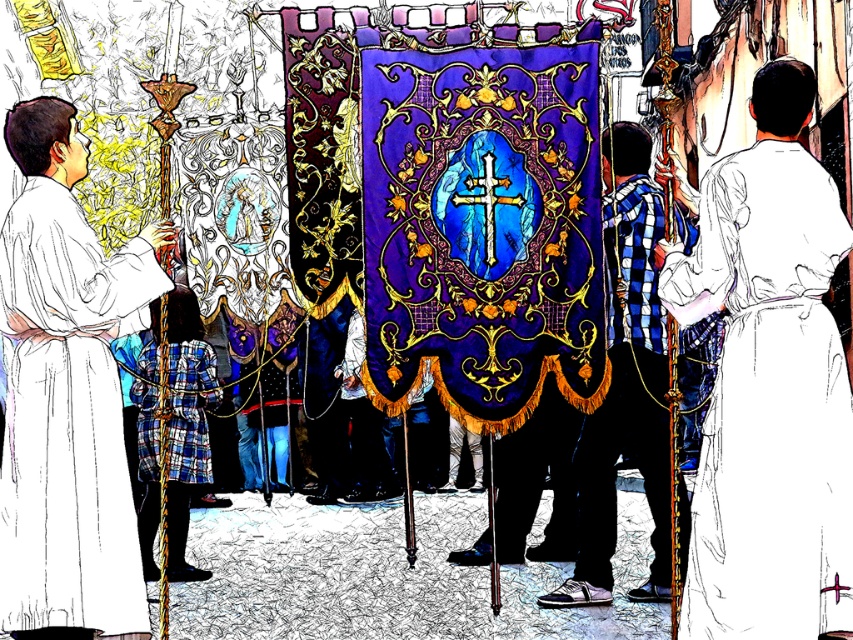
You are a photographer trying to capture the procession. You notice the white cloth robe at right and the plaid fabric robe at center. Which robe should you zoom in on to ensure it takes up more space in your photo?

The white cloth robe at right is bigger than the plaid fabric robe at center, so zooming in on the white cloth robe at right will make it take up more space in the photo.

You are a photographer capturing the religious procession. You notice the white cloth robe at right and the plaid fabric robe at center. Which robe should you focus on to capture a taller subject?

The white cloth robe at right is taller than the plaid fabric robe at center, so focusing on the white cloth robe at right will capture a taller subject.